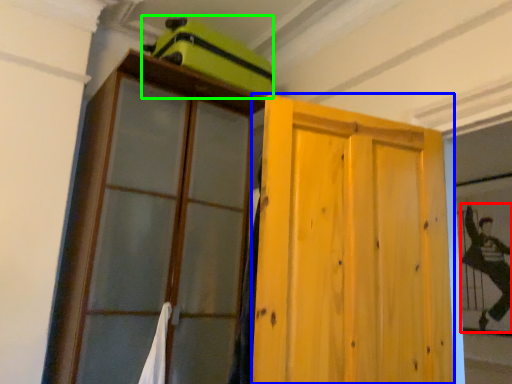
Question: Estimate the real-world distances between objects in this image. Which object is closer to couple (highlighted by a red box), door (highlighted by a blue box) or luggage (highlighted by a green box)?

Choices:
 (A) door
 (B) luggage

Answer: (A)